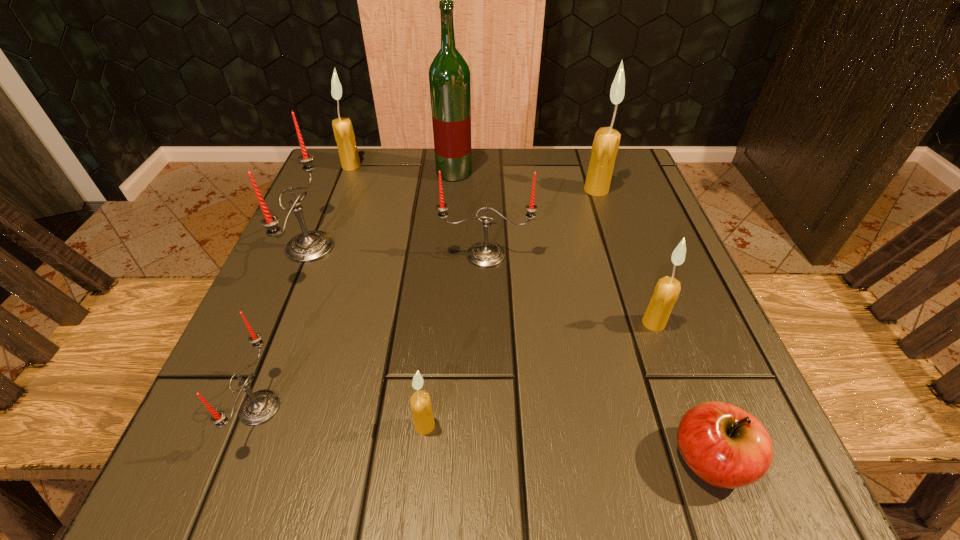
Identify which candle is the fifth closest to the third smallest cream candle. Please provide its 2D coordinates. Your answer should be formatted as a tuple, i.e. [(x, y)], where the tuple contains the x and y coordinates of a point satisfying the conditions above.

[(421, 406)]

In order to click on the second closest cream candle relative to the rightmost red candle in this screenshot , I will do `click(605, 146)`.

This screenshot has height=540, width=960. What are the coordinates of `the third closest cream candle relative to the biggest red candle` in the screenshot? It's located at (605, 146).

Identify the location of the third closest red candle relative to the second farthest cream candle. (259, 407).

At what (x,y) coordinates should I click in order to perform the action: click on red candle that can be found as the third closest to the green liquor. Please return your answer as a coordinate pair (x, y). This screenshot has height=540, width=960. Looking at the image, I should click on pos(259,407).

Image resolution: width=960 pixels, height=540 pixels. I want to click on free location that satisfies the following two spatial constraints: 1. on the front-facing side of the apple; 2. on the right side of the second biggest red candle, so click(490, 459).

This screenshot has height=540, width=960. Identify the location of free space that satisfies the following two spatial constraints: 1. on the front side of the fourth nearest object; 2. on the right side of the sixth nearest candle. (640, 323).

Locate an element on the screen. free space that satisfies the following two spatial constraints: 1. on the front-facing side of the smallest red candle; 2. on the back side of the third cream candle from right to left is located at coordinates (253, 425).

The image size is (960, 540). Identify the location of free location that satisfies the following two spatial constraints: 1. on the front-facing side of the biggest red candle; 2. on the back side of the third biggest cream candle. (279, 323).

What are the coordinates of `free space in the image that satisfies the following two spatial constraints: 1. on the front-facing side of the third cream candle from right to left; 2. on the left side of the biggest red candle` in the screenshot? It's located at (237, 425).